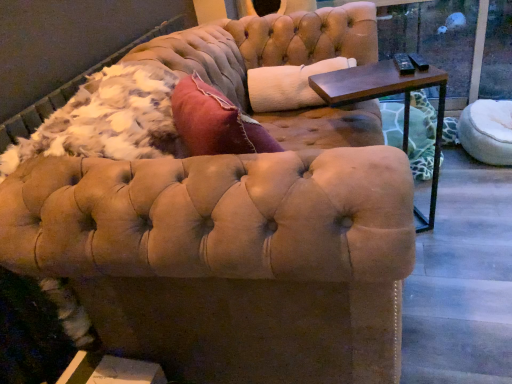
Question: Is white fluffy pet bed at right taller or shorter than transparent glass window screen at upper right?

Choices:
 (A) short
 (B) tall

Answer: (A)

Question: In the image, is white fluffy pet bed at right positioned in front of or behind transparent glass window screen at upper right?

Choices:
 (A) front
 (B) behind

Answer: (A)

Question: Which is farther from the transparent glass window screen at upper right?

Choices:
 (A) white fluffy pet bed at right
 (B) dark brown wood side table at upper right

Answer: (B)

Question: Which object is positioned farthest from the white fluffy pet bed at right?

Choices:
 (A) dark brown wood side table at upper right
 (B) transparent glass window screen at upper right

Answer: (A)